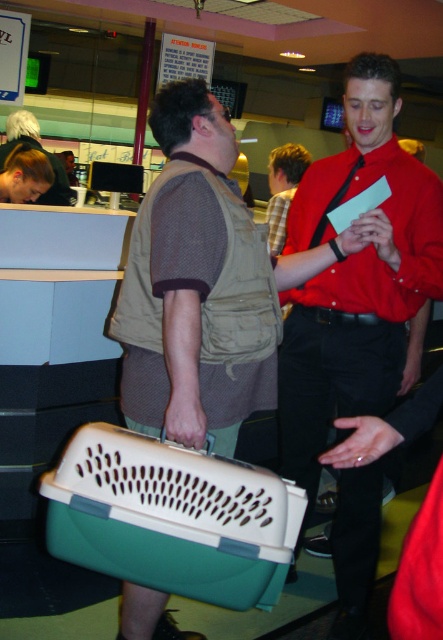
You are standing in the bowling alley and need to determine which of the two points, point (290, 296) or point (57, 160), is nearer to you. Based on the scene description, which point is closer?

Point (290, 296) is closer to the viewer than point (57, 160).

You are a customer at the bowling alley and need to place your items on the counter. The counter has limited space. Which item, the matte plastic pet carrier at lower left or the matte brown vest at center, should you place closer to the edge of the counter to ensure it doesn not fall off?

The matte plastic pet carrier at lower left is positioned under the matte brown vest at center, so placing the matte brown vest at center closer to the edge would prevent it from falling off since it is supported by the carrier below.